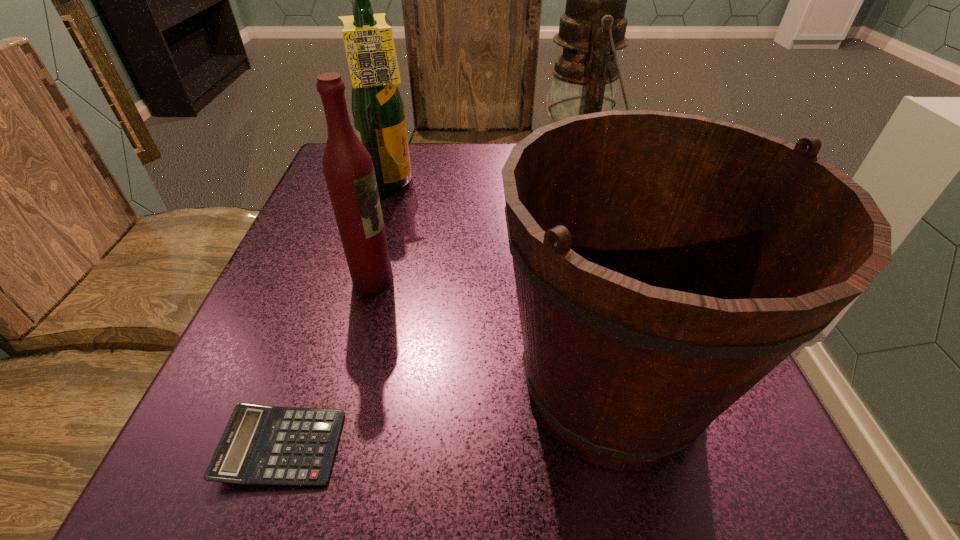
At what (x,y) coordinates should I click in order to perform the action: click on vacant space that is in between the calculator and the bucket. Please return your answer as a coordinate pair (x, y). This screenshot has height=540, width=960. Looking at the image, I should click on (447, 413).

I want to click on free space between the farther liquor and the lantern, so pos(483,180).

At what (x,y) coordinates should I click in order to perform the action: click on free spot between the lantern and the third farthest object. Please return your answer as a coordinate pair (x, y). Image resolution: width=960 pixels, height=540 pixels. Looking at the image, I should click on (474, 227).

The height and width of the screenshot is (540, 960). I want to click on free space between the lantern and the shortest object, so click(428, 311).

I want to click on vacant region between the lantern and the farther liquor, so click(x=483, y=180).

Identify which object is located as the second nearest to the shortest object. Please provide its 2D coordinates. Your answer should be formatted as a tuple, i.e. [(x, y)], where the tuple contains the x and y coordinates of a point satisfying the conditions above.

[(348, 169)]

Locate which object ranks second in proximity to the farther liquor. Please provide its 2D coordinates. Your answer should be formatted as a tuple, i.e. [(x, y)], where the tuple contains the x and y coordinates of a point satisfying the conditions above.

[(593, 27)]

Image resolution: width=960 pixels, height=540 pixels. I want to click on free space that satisfies the following two spatial constraints: 1. on the label of the bucket; 2. on the left side of the shorter liquor, so click(x=348, y=379).

Identify the location of vacant area in the image that satisfies the following two spatial constraints: 1. on the back side of the calculator; 2. on the left side of the lantern. This screenshot has height=540, width=960. (374, 175).

Where is `vacant space that satisfies the following two spatial constraints: 1. on the front-facing side of the bucket; 2. on the left side of the farther liquor`? The image size is (960, 540). vacant space that satisfies the following two spatial constraints: 1. on the front-facing side of the bucket; 2. on the left side of the farther liquor is located at coordinates (336, 379).